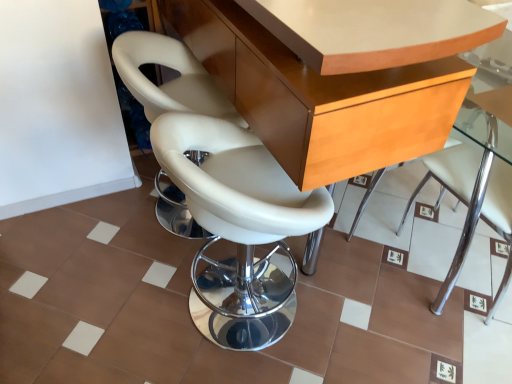
The image size is (512, 384). Identify the location of space that is in front of white leather chair at center, which is counted as the first chair, starting from the left. (124, 297).